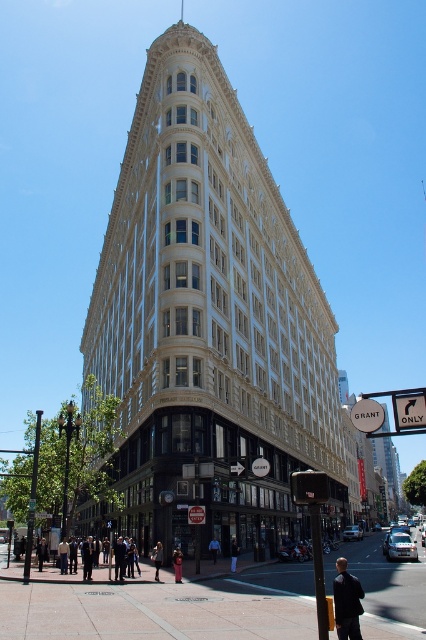
Question: Which of the following is the farthest from the observer?

Choices:
 (A) concrete sidewalk at lower center
 (B) white stone building at center

Answer: (B)

Question: Is white stone building at center further to the viewer compared to concrete sidewalk at lower center?

Choices:
 (A) yes
 (B) no

Answer: (A)

Question: Does white stone building at center appear on the left side of concrete sidewalk at lower center?

Choices:
 (A) yes
 (B) no

Answer: (A)

Question: Can you confirm if white stone building at center is wider than concrete sidewalk at lower center?

Choices:
 (A) yes
 (B) no

Answer: (A)